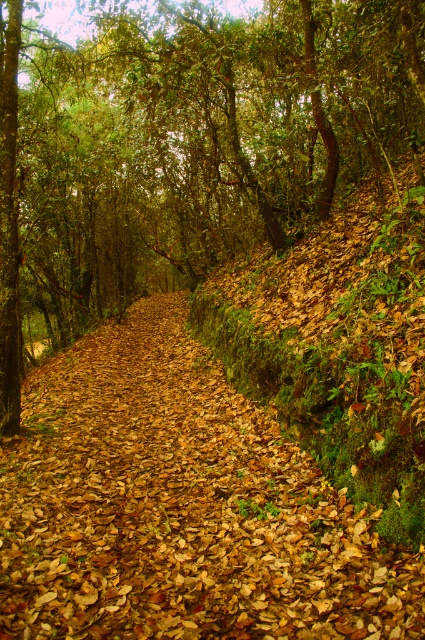
Question: Is green leafy tree at center wider than brown leafy forest path at center?

Choices:
 (A) no
 (B) yes

Answer: (B)

Question: Which of the following is the closest to the observer?

Choices:
 (A) green leafy tree at center
 (B) brown leafy forest path at center

Answer: (B)

Question: Where is green leafy tree at center located in relation to brown leafy forest path at center in the image?

Choices:
 (A) right
 (B) left

Answer: (B)

Question: Can you confirm if green leafy tree at center is positioned below brown leafy forest path at center?

Choices:
 (A) no
 (B) yes

Answer: (A)